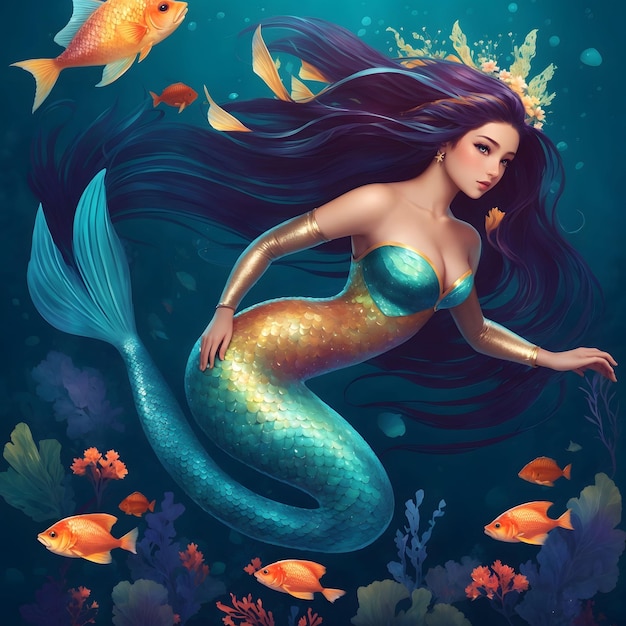
The height and width of the screenshot is (626, 626). Identify the location of scales. (317, 444), (307, 541), (244, 519).